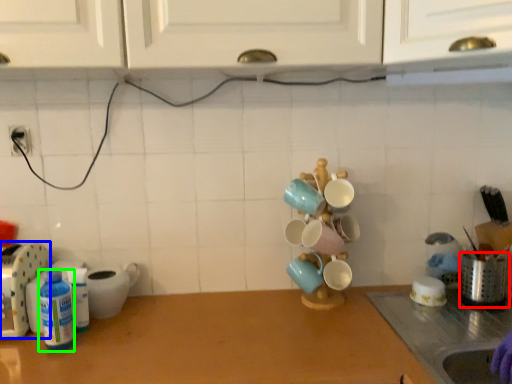
Question: Based on their relative distances, which object is farther from appliance (highlighted by a red box)? Choose from appliance (highlighted by a blue box) and bottle (highlighted by a green box).

Choices:
 (A) appliance
 (B) bottle

Answer: (A)